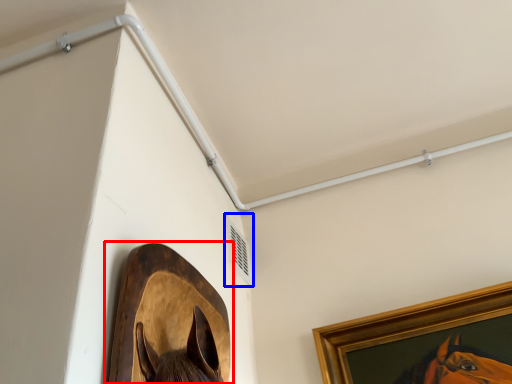
Question: Which object is further to the camera taking this photo, picture frame (highlighted by a red box) or air conditioning (highlighted by a blue box)?

Choices:
 (A) picture frame
 (B) air conditioning

Answer: (B)